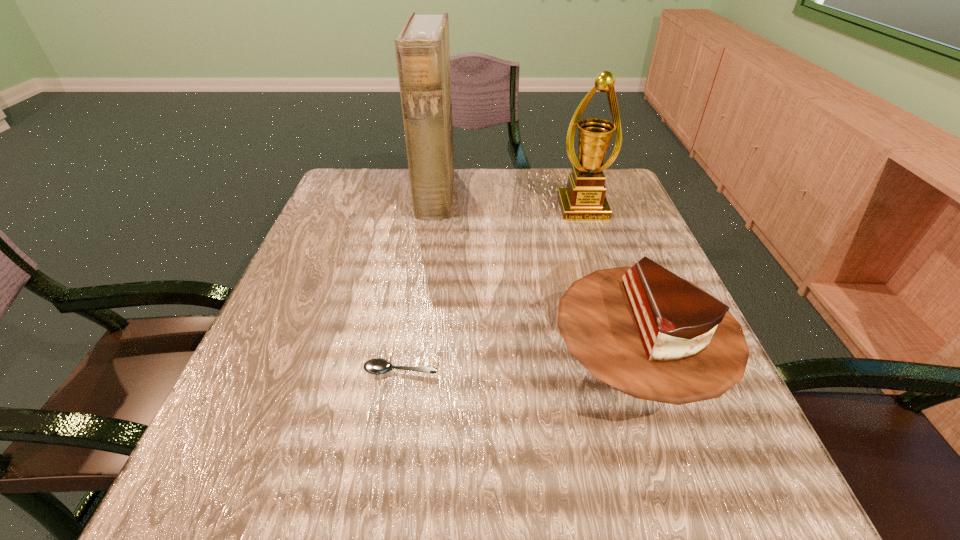
The image size is (960, 540). I want to click on award at the right edge, so click(x=584, y=199).

Locate an element on the screen. This screenshot has width=960, height=540. cake that is at the right edge is located at coordinates (645, 331).

Find the location of a particular element. object that is at the far right corner is located at coordinates (584, 199).

Where is `blank area at the far edge`? This screenshot has width=960, height=540. blank area at the far edge is located at coordinates (400, 200).

What are the coordinates of `vacant space at the near edge of the desktop` in the screenshot? It's located at (600, 489).

The image size is (960, 540). I want to click on vacant position at the left edge of the desktop, so click(280, 456).

Locate an element on the screen. free space at the right edge of the desktop is located at coordinates (606, 251).

Identify the location of vacant space at the far left corner of the desktop. (352, 213).

This screenshot has height=540, width=960. Identify the location of free space at the far right corner. (618, 205).

Find the location of a particular element. blank space at the near right corner of the desktop is located at coordinates (777, 496).